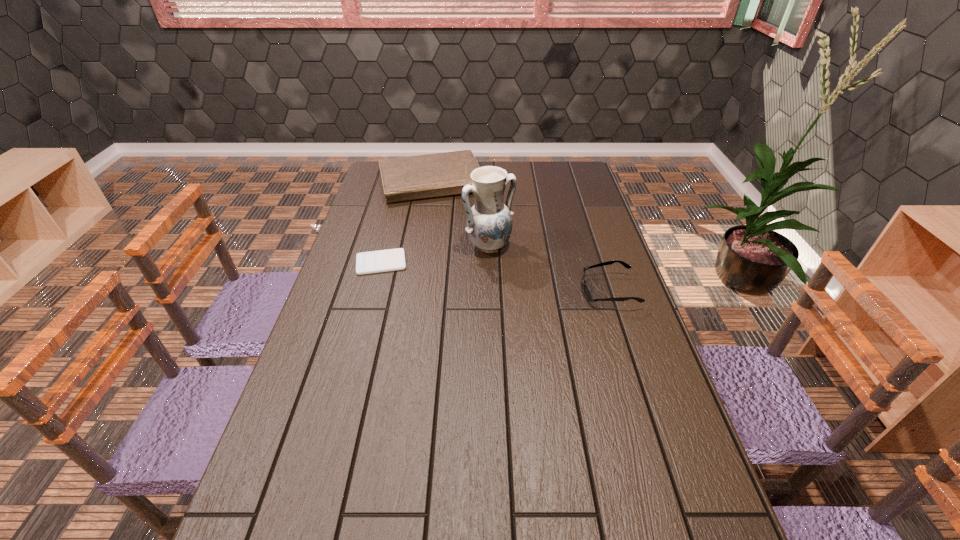
Locate an element on the screen. This screenshot has width=960, height=540. vacant space on the desktop that is between the calculator and the rightmost object and is positioned on the spine side of the farthest object is located at coordinates (466, 273).

The width and height of the screenshot is (960, 540). I want to click on free space on the desktop that is between the shortest object and the rightmost object and is positioned on either side of the tallest object, so click(x=524, y=281).